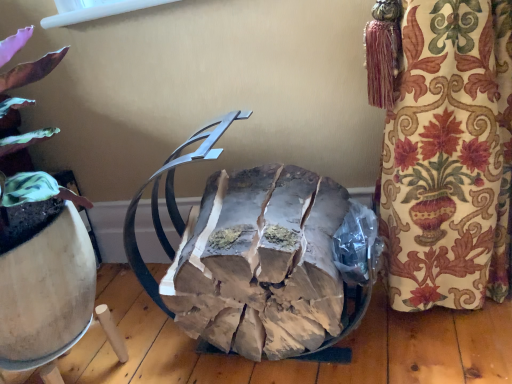
Describe the element at coordinates (267, 263) in the screenshot. I see `natural wood logs at center` at that location.

The height and width of the screenshot is (384, 512). I want to click on natural wood logs at center, so [x=267, y=263].

Where is `white plastic window screen at upper center`? The image size is (512, 384). white plastic window screen at upper center is located at coordinates (94, 10).

Image resolution: width=512 pixels, height=384 pixels. What do you see at coordinates (94, 10) in the screenshot?
I see `white plastic window screen at upper center` at bounding box center [94, 10].

The height and width of the screenshot is (384, 512). Identify the location of natural wood logs at center. (267, 263).

Is white plastic window screen at upper center to the left of natural wood logs at center from the viewer's perspective?

Yes.

Does white plastic window screen at upper center come behind natural wood logs at center?

Yes, white plastic window screen at upper center is further from the camera.

Does point (106, 9) come closer to viewer compared to point (217, 332)?

No, it is not.

From the image's perspective, is white plastic window screen at upper center positioned above or below natural wood logs at center?

From the image's perspective, white plastic window screen at upper center appears above natural wood logs at center.

In the scene shown: From a real-world perspective, is white plastic window screen at upper center located beneath natural wood logs at center?

Incorrect, from a real-world perspective, white plastic window screen at upper center is higher than natural wood logs at center.

Considering the sizes of objects white plastic window screen at upper center and natural wood logs at center in the image provided, who is thinner, white plastic window screen at upper center or natural wood logs at center?

white plastic window screen at upper center is thinner.

Considering the relative sizes of white plastic window screen at upper center and natural wood logs at center in the image provided, is white plastic window screen at upper center taller than natural wood logs at center?

Incorrect, the height of white plastic window screen at upper center is not larger of that of natural wood logs at center.

Between white plastic window screen at upper center and natural wood logs at center, which one has smaller size?

Smaller between the two is white plastic window screen at upper center.

Which is correct: white plastic window screen at upper center is inside natural wood logs at center, or outside of it?

The correct answer is: outside.

Is white plastic window screen at upper center touching natural wood logs at center?

white plastic window screen at upper center is not next to natural wood logs at center, and they're not touching.

Could you tell me if white plastic window screen at upper center is facing natural wood logs at center?

No.

Can you tell me how much white plastic window screen at upper center and natural wood logs at center differ in facing direction?

2.51 degrees.

I want to click on window screen above the natural wood logs at center (from a real-world perspective), so click(94, 10).

Would you say natural wood logs at center is to the left or to the right of white plastic window screen at upper center in the picture?

In the image, natural wood logs at center appears on the right side of white plastic window screen at upper center.

Is natural wood logs at center positioned behind white plastic window screen at upper center?

No, it is in front of white plastic window screen at upper center.

Considering the positions of point (240, 189) and point (159, 1), is point (240, 189) closer or farther from the camera than point (159, 1)?

Clearly, point (240, 189) is closer to the camera than point (159, 1).

From the image's perspective, is natural wood logs at center over white plastic window screen at upper center?

No, from the image's perspective, natural wood logs at center is not above white plastic window screen at upper center.

From a real-world perspective, relative to white plastic window screen at upper center, is natural wood logs at center vertically above or below?

From a real-world perspective, natural wood logs at center is physically below white plastic window screen at upper center.

In terms of width, does natural wood logs at center look wider or thinner when compared to white plastic window screen at upper center?

natural wood logs at center is wider than white plastic window screen at upper center.

Consider the image. In terms of height, does natural wood logs at center look taller or shorter compared to white plastic window screen at upper center?

Clearly, natural wood logs at center is taller compared to white plastic window screen at upper center.

Between natural wood logs at center and white plastic window screen at upper center, which one has smaller size?

With smaller size is white plastic window screen at upper center.

Do you think natural wood logs at center is within white plastic window screen at upper center, or outside of it?

natural wood logs at center lies outside white plastic window screen at upper center.

Would you consider natural wood logs at center to be distant from white plastic window screen at upper center?

No, there isn't a large distance between natural wood logs at center and white plastic window screen at upper center.

Does natural wood logs at center turn towards white plastic window screen at upper center?

No, natural wood logs at center does not turn towards white plastic window screen at upper center.

This screenshot has width=512, height=384. I want to click on window screen above the natural wood logs at center (from the image's perspective), so click(94, 10).

Identify the location of waste in front of the white plastic window screen at upper center. (267, 263).

The image size is (512, 384). In order to click on waste located below the white plastic window screen at upper center (from the image's perspective) in this screenshot , I will do `click(267, 263)`.